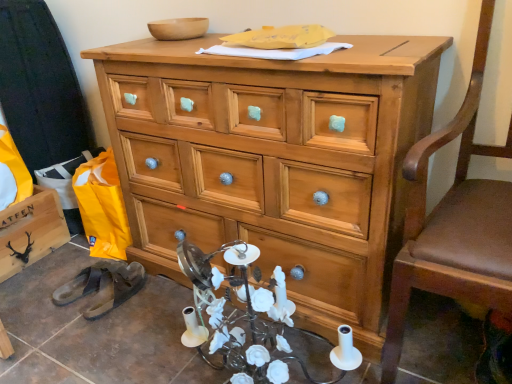
The width and height of the screenshot is (512, 384). Find the location of `black rubber sandals at lower left`. black rubber sandals at lower left is located at coordinates (116, 286).

You are a GUI agent. You are given a task and a screenshot of the screen. Output one action in this format:
    pyautogui.click(x=<x>, y=<y>)
    Task: Click on the natural wood chest of drawers at center
    
    Given the screenshot: What is the action you would take?
    (x=274, y=161)

The height and width of the screenshot is (384, 512). I want to click on brown leather swivel chair at right, so click(x=454, y=221).

Is natural wood chest of drawers at center positioned with its back to black matte wooden cabinet at lower left?

No, natural wood chest of drawers at center's orientation is not away from black matte wooden cabinet at lower left.

From the image's perspective, which is below, natural wood chest of drawers at center or black matte wooden cabinet at lower left?

black matte wooden cabinet at lower left appears lower in the image.

Does natural wood chest of drawers at center appear on the left side of black matte wooden cabinet at lower left?

Incorrect, natural wood chest of drawers at center is not on the left side of black matte wooden cabinet at lower left.

This screenshot has width=512, height=384. Find the location of `the chest of drawers that appears above the black matte wooden cabinet at lower left (from the image's perspective)`. the chest of drawers that appears above the black matte wooden cabinet at lower left (from the image's perspective) is located at coordinates (274, 161).

Does black rubber sandals at lower left contain brown leather swivel chair at right?

Actually, brown leather swivel chair at right is outside black rubber sandals at lower left.

Considering the sizes of objects black rubber sandals at lower left and brown leather swivel chair at right in the image provided, who is bigger, black rubber sandals at lower left or brown leather swivel chair at right?

Bigger between the two is brown leather swivel chair at right.

Is point (134, 289) farther from viewer compared to point (459, 129)?

That is True.

Which object is further away from the camera, brown leather swivel chair at right or natural wood chest of drawers at center?

natural wood chest of drawers at center is further from the camera.

Image resolution: width=512 pixels, height=384 pixels. What are the coordinates of `the chest of drawers beneath the brown leather swivel chair at right (from a real-world perspective)` in the screenshot? It's located at (274, 161).

Is brown leather swivel chair at right directly adjacent to natural wood chest of drawers at center?

No.

From the image's perspective, is brown leather swivel chair at right located above or below black rubber sandals at lower left?

Based on their image positions, brown leather swivel chair at right is located above black rubber sandals at lower left.

Consider the image. Is brown leather swivel chair at right oriented towards black rubber sandals at lower left?

No, brown leather swivel chair at right does not turn towards black rubber sandals at lower left.

The width and height of the screenshot is (512, 384). I want to click on swivel chair that is in front of the black rubber sandals at lower left, so click(454, 221).

Is point (21, 234) positioned in front of point (455, 184)?

No, (21, 234) is further to viewer.

From a real-world perspective, who is located lower, black matte wooden cabinet at lower left or brown leather swivel chair at right?

black matte wooden cabinet at lower left is physically lower.

Can you see black matte wooden cabinet at lower left touching brown leather swivel chair at right?

No, black matte wooden cabinet at lower left is not beside brown leather swivel chair at right.

Is black matte wooden cabinet at lower left not within brown leather swivel chair at right?

Yes, black matte wooden cabinet at lower left is outside of brown leather swivel chair at right.

Is brown leather swivel chair at right facing away from black matte wooden cabinet at lower left?

brown leather swivel chair at right does not have its back to black matte wooden cabinet at lower left.

Considering the sizes of objects brown leather swivel chair at right and black matte wooden cabinet at lower left in the image provided, who is bigger, brown leather swivel chair at right or black matte wooden cabinet at lower left?

brown leather swivel chair at right is bigger.

From the image's perspective, is brown leather swivel chair at right over black matte wooden cabinet at lower left?

Indeed, from the image's perspective, brown leather swivel chair at right is shown above black matte wooden cabinet at lower left.

From a real-world perspective, is brown leather swivel chair at right positioned above or below black matte wooden cabinet at lower left?

From a real-world perspective, brown leather swivel chair at right is physically above black matte wooden cabinet at lower left.

Choose the correct answer: Is black rubber sandals at lower left inside black matte wooden cabinet at lower left or outside it?

black rubber sandals at lower left cannot be found inside black matte wooden cabinet at lower left.

Which object is closer to the camera taking this photo, black rubber sandals at lower left or black matte wooden cabinet at lower left?

black rubber sandals at lower left is in front.

Consider the image. Are black rubber sandals at lower left and black matte wooden cabinet at lower left located far from each other?

That's not correct — black rubber sandals at lower left is a little close to black matte wooden cabinet at lower left.

Find the location of a particular element. chest of drawers on the right of black matte wooden cabinet at lower left is located at coordinates (274, 161).

I want to click on footwear that is on the left side of brown leather swivel chair at right, so click(x=116, y=286).

Considering their positions, is black rubber sandals at lower left positioned closer to black matte wooden cabinet at lower left than natural wood chest of drawers at center?

black rubber sandals at lower left is positioned closer to the anchor black matte wooden cabinet at lower left.

When comparing their distances from natural wood chest of drawers at center, does black rubber sandals at lower left or black matte wooden cabinet at lower left seem closer?

Among the two, black rubber sandals at lower left is located nearer to natural wood chest of drawers at center.

Looking at the image, which one is located further to black matte wooden cabinet at lower left, brown leather swivel chair at right or black rubber sandals at lower left?

Based on the image, brown leather swivel chair at right appears to be further to black matte wooden cabinet at lower left.

From the image, which object appears to be farther from brown leather swivel chair at right, natural wood chest of drawers at center or black rubber sandals at lower left?

The object further to brown leather swivel chair at right is black rubber sandals at lower left.

From the image, which object appears to be nearer to black rubber sandals at lower left, brown leather swivel chair at right or black matte wooden cabinet at lower left?

The object closer to black rubber sandals at lower left is black matte wooden cabinet at lower left.

When comparing their distances from black matte wooden cabinet at lower left, does natural wood chest of drawers at center or black rubber sandals at lower left seem further?

natural wood chest of drawers at center is further to black matte wooden cabinet at lower left.

When comparing their distances from brown leather swivel chair at right, does black rubber sandals at lower left or black matte wooden cabinet at lower left seem further?

The object further to brown leather swivel chair at right is black matte wooden cabinet at lower left.

In the scene shown: Looking at the image, which one is located further to black rubber sandals at lower left, natural wood chest of drawers at center or brown leather swivel chair at right?

Among the two, brown leather swivel chair at right is located further to black rubber sandals at lower left.

Find the location of a particular element. The image size is (512, 384). footwear situated between black matte wooden cabinet at lower left and brown leather swivel chair at right from left to right is located at coordinates (116, 286).

Find the location of a particular element. Image resolution: width=512 pixels, height=384 pixels. chest of drawers between black matte wooden cabinet at lower left and brown leather swivel chair at right is located at coordinates (274, 161).

What are the coordinates of `the chest of drawers situated between black rubber sandals at lower left and brown leather swivel chair at right from left to right` in the screenshot? It's located at (274, 161).

At what (x,y) coordinates should I click in order to perform the action: click on footwear situated between black matte wooden cabinet at lower left and natural wood chest of drawers at center from left to right. Please return your answer as a coordinate pair (x, y). Looking at the image, I should click on (116, 286).